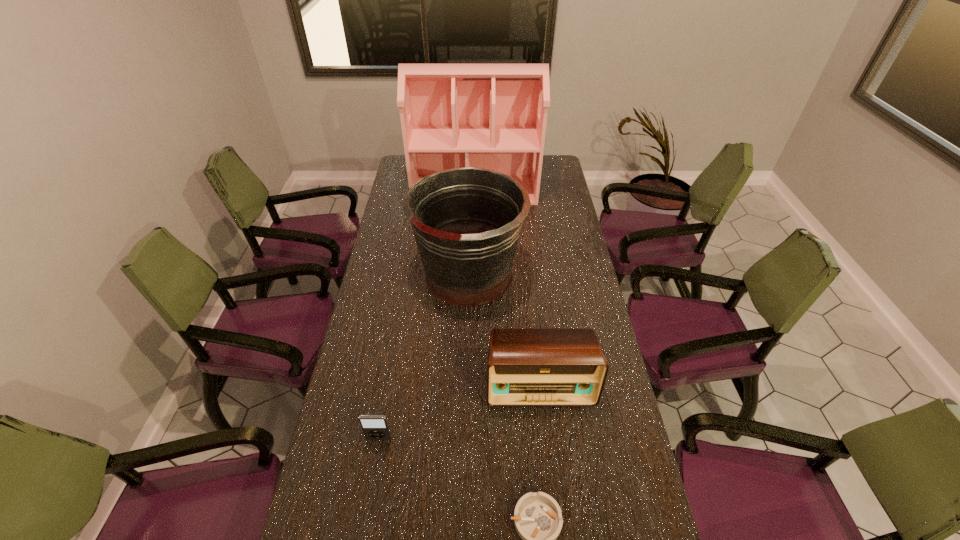
You are a GUI agent. You are given a task and a screenshot of the screen. Output one action in this format:
    pyautogui.click(x=<x>, y=<y>)
    Task: Click on the dollhouse
    The image size is (960, 540).
    Given the screenshot: What is the action you would take?
    pyautogui.click(x=493, y=116)

Identify the location of the tallest object. (493, 116).

Find the location of `the second farthest object`. the second farthest object is located at coordinates (467, 221).

The height and width of the screenshot is (540, 960). Find the location of `the fourth shortest object`. the fourth shortest object is located at coordinates (467, 221).

Where is `the third tallest object`? Image resolution: width=960 pixels, height=540 pixels. the third tallest object is located at coordinates (x=526, y=367).

Identify the location of the third farthest object. (526, 367).

At what (x,y) coordinates should I click in order to perform the action: click on the second shortest object. Please return your answer as a coordinate pair (x, y). The width and height of the screenshot is (960, 540). Looking at the image, I should click on (375, 427).

The image size is (960, 540). Find the location of `the second nearest object`. the second nearest object is located at coordinates (375, 427).

Where is `vacant space situated 0.060m on the front-facing side of the tallest object`? This screenshot has height=540, width=960. vacant space situated 0.060m on the front-facing side of the tallest object is located at coordinates (474, 214).

The height and width of the screenshot is (540, 960). I want to click on free space located on the back of the fourth nearest object, so click(x=470, y=193).